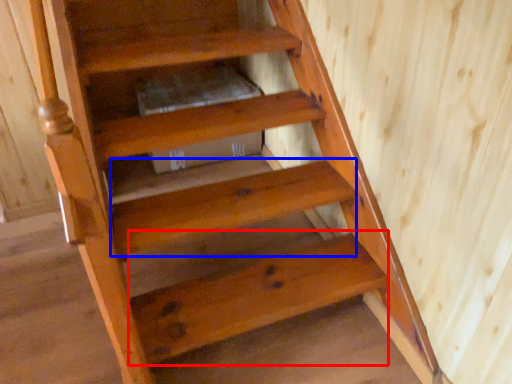
Question: Which of the following is the closest to the observer, stairwell (highlighted by a red box) or stairwell (highlighted by a blue box)?

Choices:
 (A) stairwell
 (B) stairwell

Answer: (A)